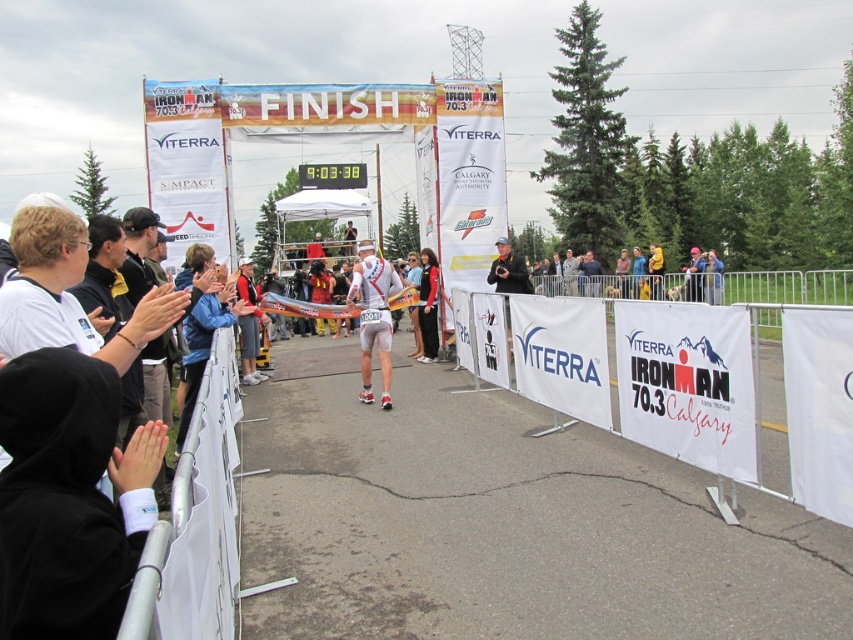
Which of these two, white fabric banner at center or white plastic barrier at lower left, stands taller?

With more height is white plastic barrier at lower left.

Can you confirm if white fabric banner at center is wider than white plastic barrier at lower left?

Incorrect, white fabric banner at center's width does not surpass white plastic barrier at lower left's.

In order to click on white fabric banner at center in this screenshot , I will do `click(679, 381)`.

The image size is (853, 640). I want to click on white matte triathlon suit at center, so click(373, 316).

Is white matte triathlon suit at center further to the viewer compared to black fabric at center?

That is False.

You are a GUI agent. You are given a task and a screenshot of the screen. Output one action in this format:
    pyautogui.click(x=<x>, y=<y>)
    Task: Click on the white matte triathlon suit at center
    Image resolution: width=853 pixels, height=640 pixels.
    Given the screenshot: What is the action you would take?
    pyautogui.click(x=373, y=316)

Which is behind, point (199, 624) or point (419, 310)?

Positioned behind is point (419, 310).

Who is taller, white plastic barrier at lower left or black fabric jacket at center?

With more height is black fabric jacket at center.

Find the location of a particular element. The width and height of the screenshot is (853, 640). white plastic barrier at lower left is located at coordinates (195, 524).